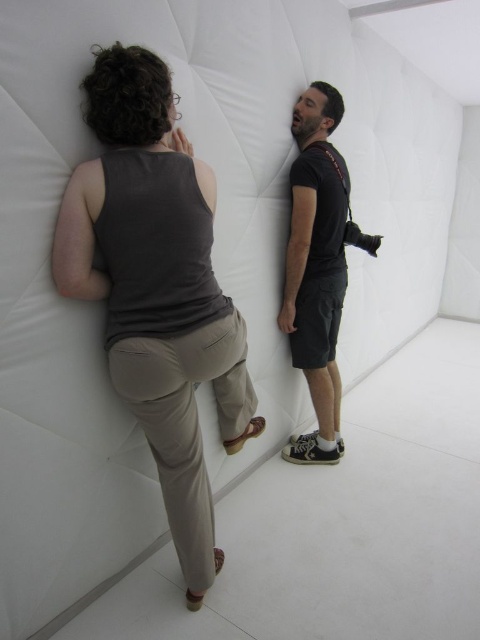
Is matte gray tank top at upper left smaller than black matte shirt at center?

Actually, matte gray tank top at upper left might be larger than black matte shirt at center.

Can you confirm if matte gray tank top at upper left is positioned to the left of black matte shirt at center?

Indeed, matte gray tank top at upper left is positioned on the left side of black matte shirt at center.

The height and width of the screenshot is (640, 480). Describe the element at coordinates (157, 289) in the screenshot. I see `matte gray tank top at upper left` at that location.

This screenshot has width=480, height=640. Identify the location of matte gray tank top at upper left. (157, 289).